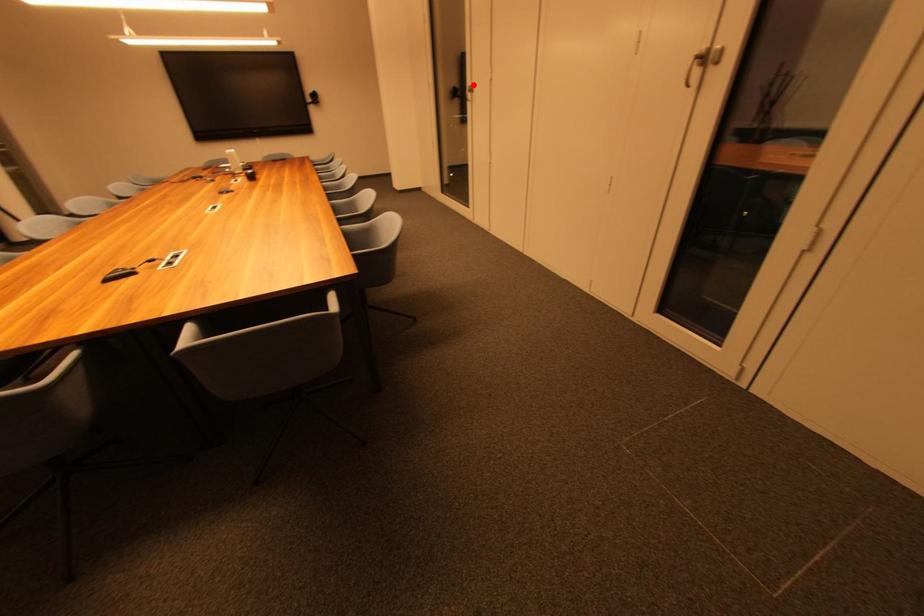
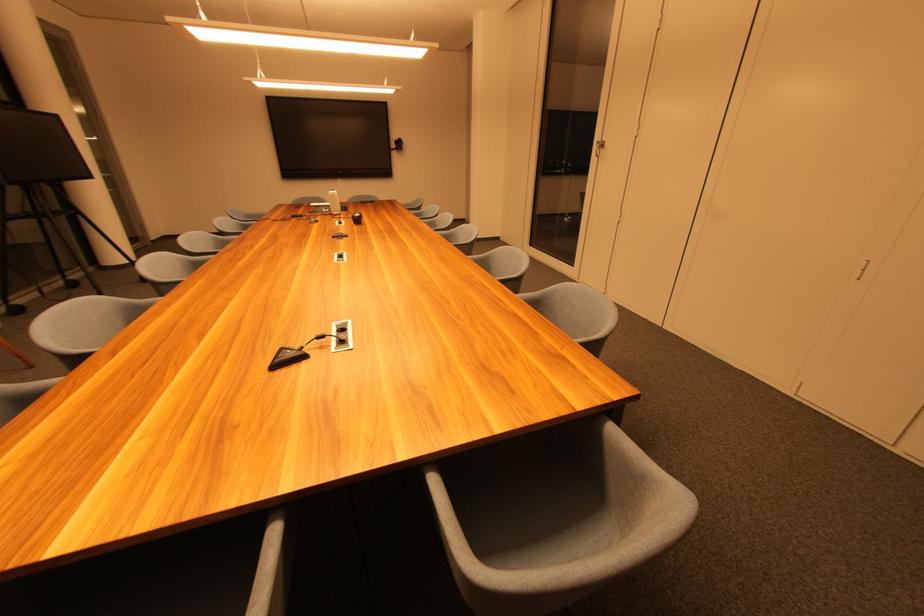
In the second image, find the point that corresponds to the highlighted location in the first image.

(602, 140)